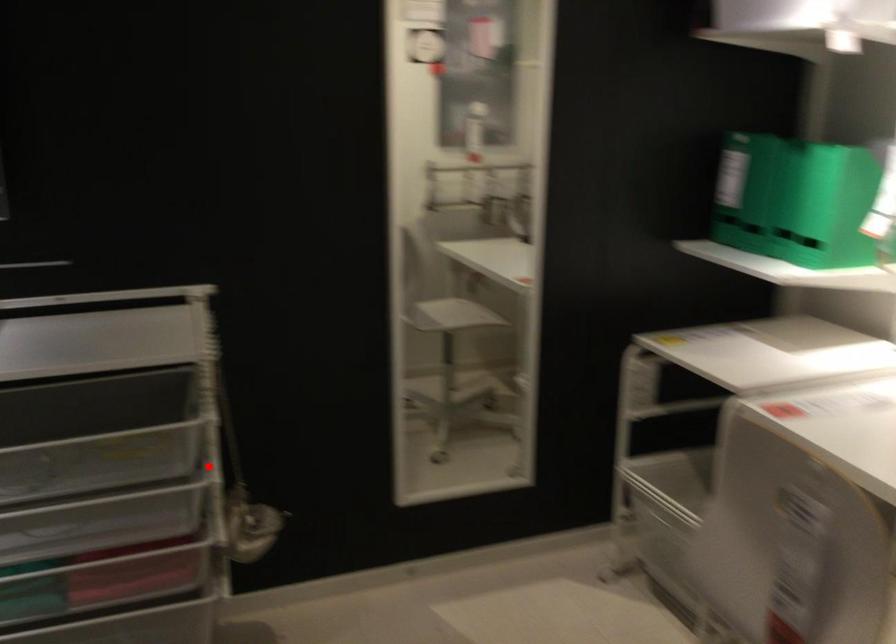
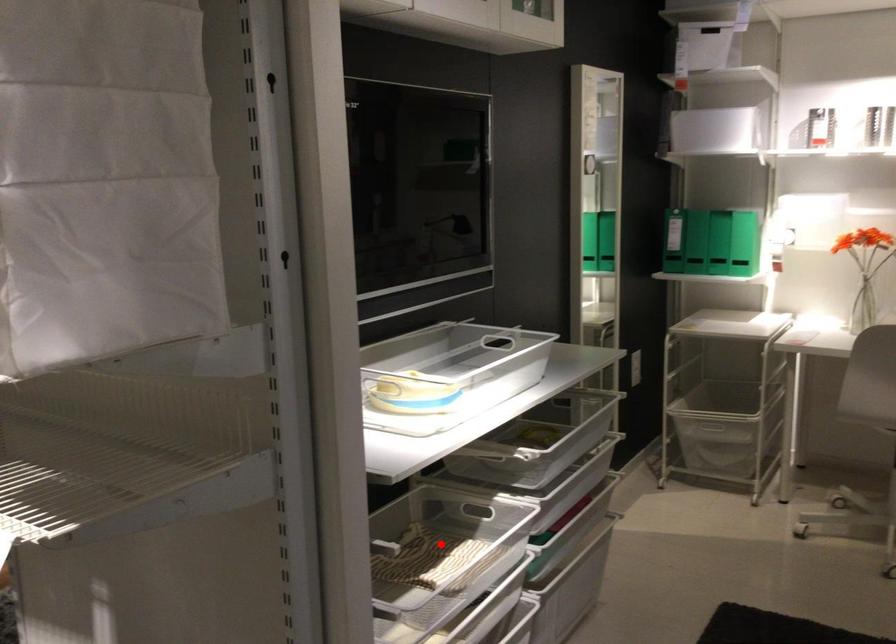
I am providing you with two images of the same scene from different viewpoints. A red point is marked on the first image and another point is marked on the second image. Does the point marked in image1 correspond to the same location as the one in image2?

No